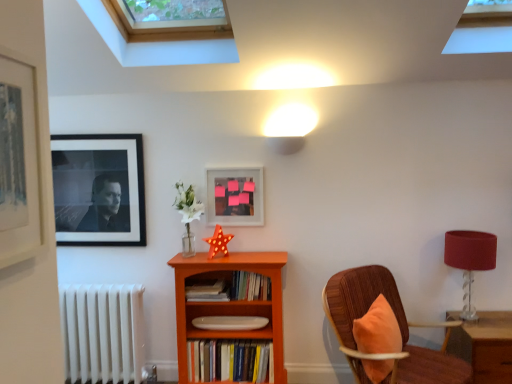
Question: Is wooden chair with orange cushion at right spatially inside white metallic radiator at lower left, or outside of it?

Choices:
 (A) inside
 (B) outside

Answer: (B)

Question: Considering the relative positions of wooden chair with orange cushion at right and white metallic radiator at lower left in the image provided, is wooden chair with orange cushion at right to the left or to the right of white metallic radiator at lower left?

Choices:
 (A) right
 (B) left

Answer: (A)

Question: Which object is the closest to the hardcover books at center, which is counted as the first book, starting from the top?

Choices:
 (A) white matte plate at center, which is counted as the first book, starting from the bottom
 (B) matte black picture frame at upper left, which is counted as the 3th picture frame, starting from the right
 (C) matte glass picture frame at center, which is counted as the first picture frame, starting from the right
 (D) wooden chair with orange cushion at right
 (E) matte black picture frame at left, the first picture frame in the front-to-back sequence

Answer: (A)

Question: Which is nearer to the white matte plate at center, the 3th book in the top-to-bottom sequence?

Choices:
 (A) matte black picture frame at left, marked as the second picture frame in a right-to-left arrangement
 (B) wooden chair with orange cushion at right
 (C) white metallic radiator at lower left
 (D) clear glass skylight at upper center
 (E) orange wood bookcase at center

Answer: (E)